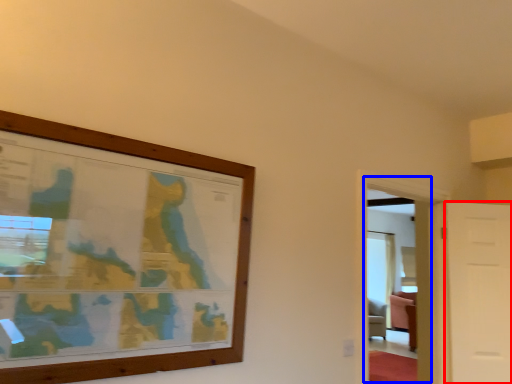
Question: Which object is closer to the camera taking this photo, door (highlighted by a red box) or glass door (highlighted by a blue box)?

Choices:
 (A) door
 (B) glass door

Answer: (B)